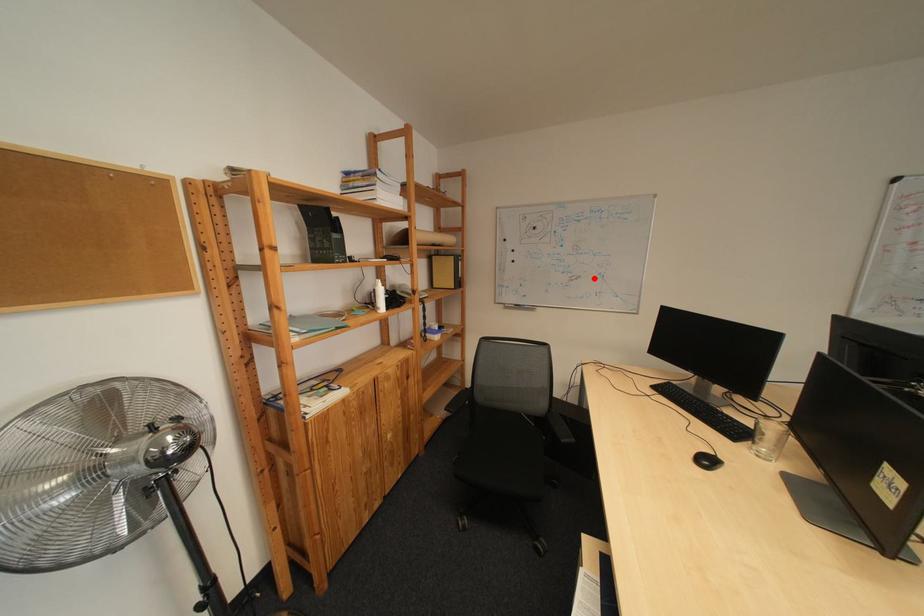
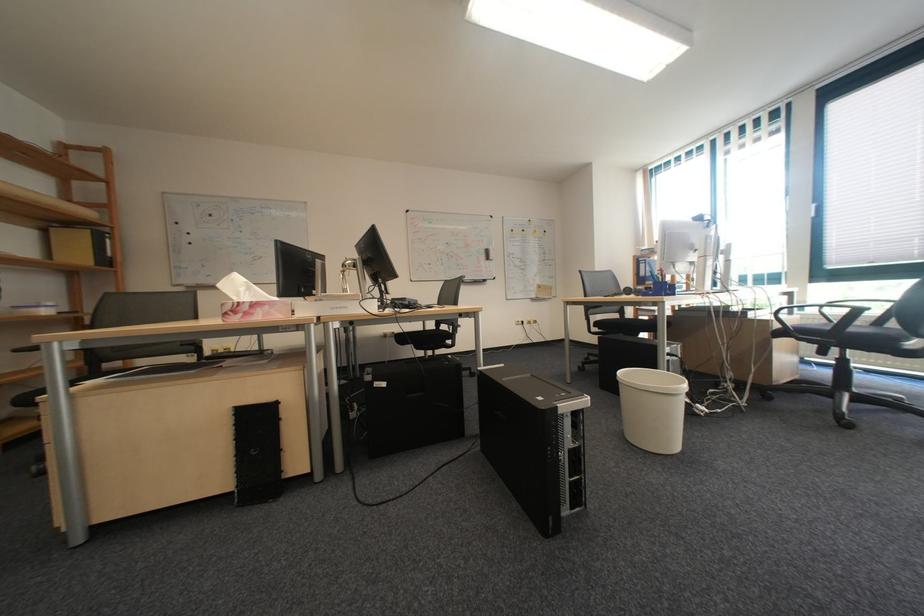
Question: I am providing you with two images of the same scene from different viewpoints. A red point is shown in image1. For the corresponding object point in image2, is it positioned nearer or farther from the camera?

Choices:
 (A) Nearer
 (B) Farther

Answer: (A)